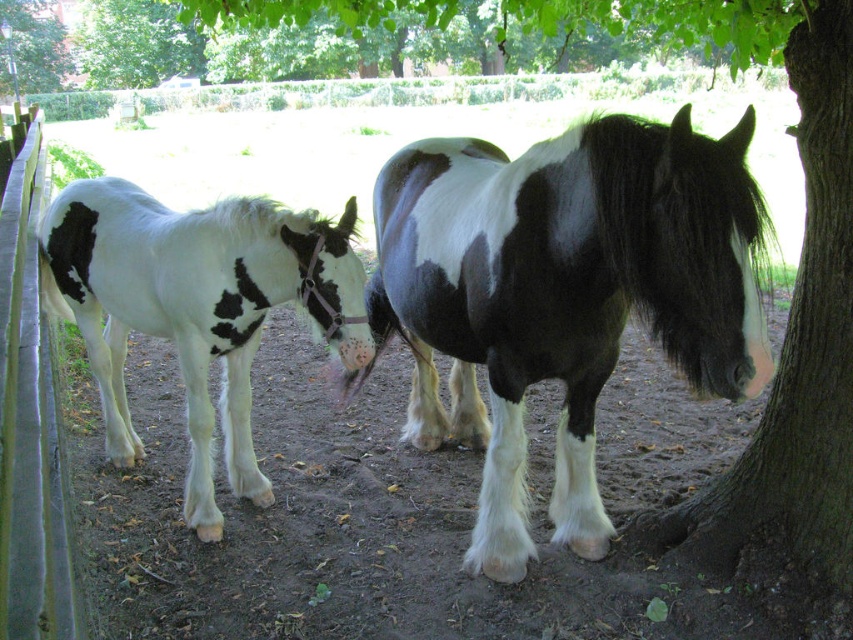
Question: Can you confirm if black and white speckled horse at center is positioned below green leafy tree at upper left?

Choices:
 (A) yes
 (B) no

Answer: (A)

Question: Does black and white speckled horse at center come in front of green leafy tree at upper left?

Choices:
 (A) yes
 (B) no

Answer: (A)

Question: Which object appears farthest from the camera in this image?

Choices:
 (A) white speckled coat at left
 (B) green leafy tree at upper left
 (C) black and white speckled horse at center

Answer: (B)

Question: Estimate the real-world distances between objects in this image. Which object is closer to the green leafy tree at upper left?

Choices:
 (A) wooden at left
 (B) white speckled coat at left

Answer: (A)

Question: Which of these objects is positioned closest to the green leafy tree at upper left?

Choices:
 (A) wooden at left
 (B) black and white speckled horse at center
 (C) white speckled coat at left

Answer: (A)

Question: Is white speckled coat at left to the left of green leafy tree at upper left from the viewer's perspective?

Choices:
 (A) no
 (B) yes

Answer: (A)